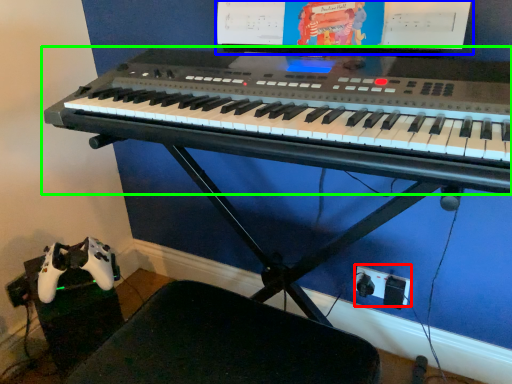
Question: Which object is positioned closest to plug (highlighted by a red box)? Select from computer monitor (highlighted by a blue box) and musical keyboard (highlighted by a green box).

Choices:
 (A) computer monitor
 (B) musical keyboard

Answer: (B)